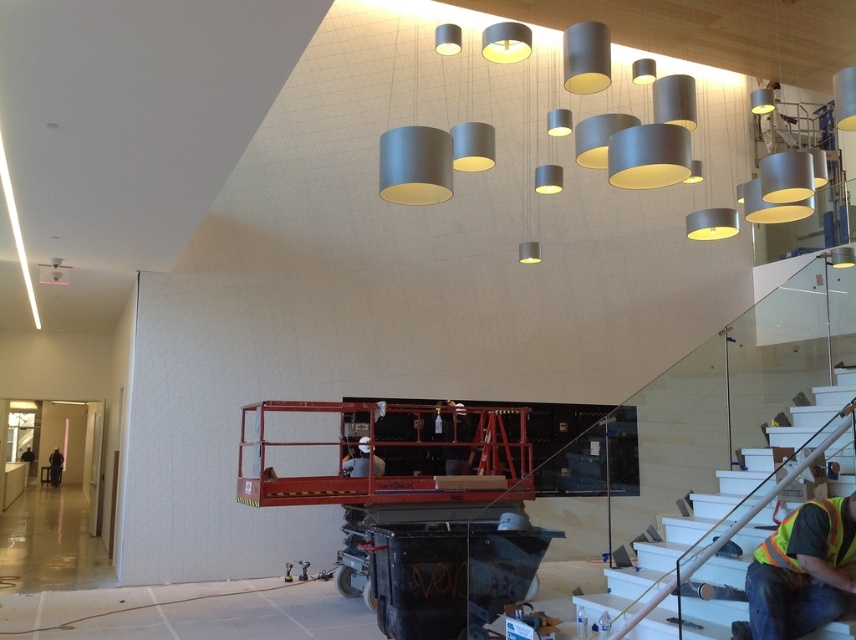
You are a construction worker with a 2.5 meter long ladder. You need to reach the top of the white glossy stair at lower right. Can you place your ladder against the stair and climb safely?

The distance between the white glossy stair at lower right and the camera is 4.70 meters. Since the ladder is only 2.5 meters long, it is too short to safely reach the top of the stair from the current position. You need a longer ladder.

You are a construction worker standing at the point marked by the coordinates point (733,522). You need to reach the red hydraulic lift platform on the left side of the image. Which direction should you walk to get there?

The point (733,522) indicates the white glossy stair at lower right. To reach the red hydraulic lift platform on the left side, you should walk towards the left.

You are a safety inspector in the construction site. You see the white glossy stair at lower right and the dark gray uniform at lower left. Which object is closer to you from your current position?

The white glossy stair at lower right is closer to you because it is in front of the dark gray uniform at lower left.